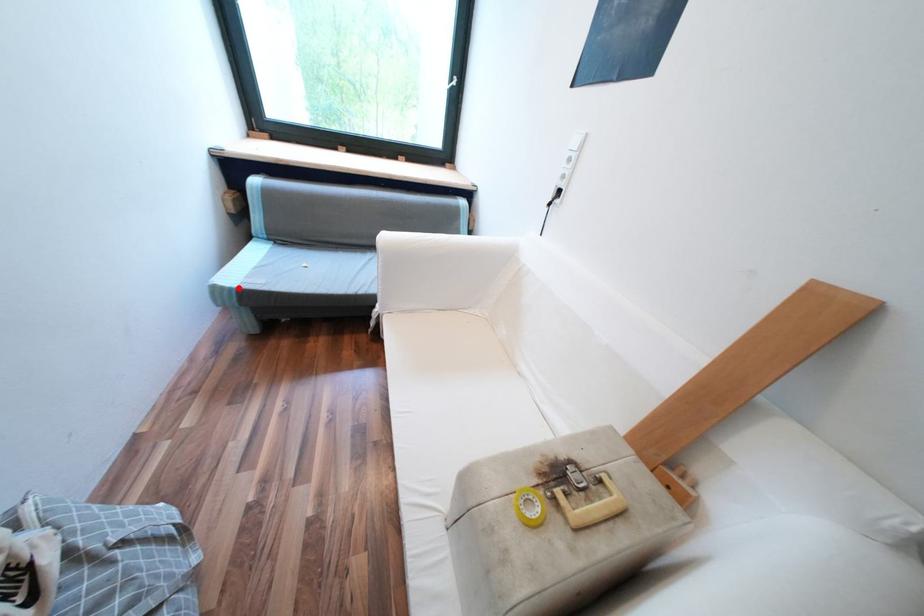
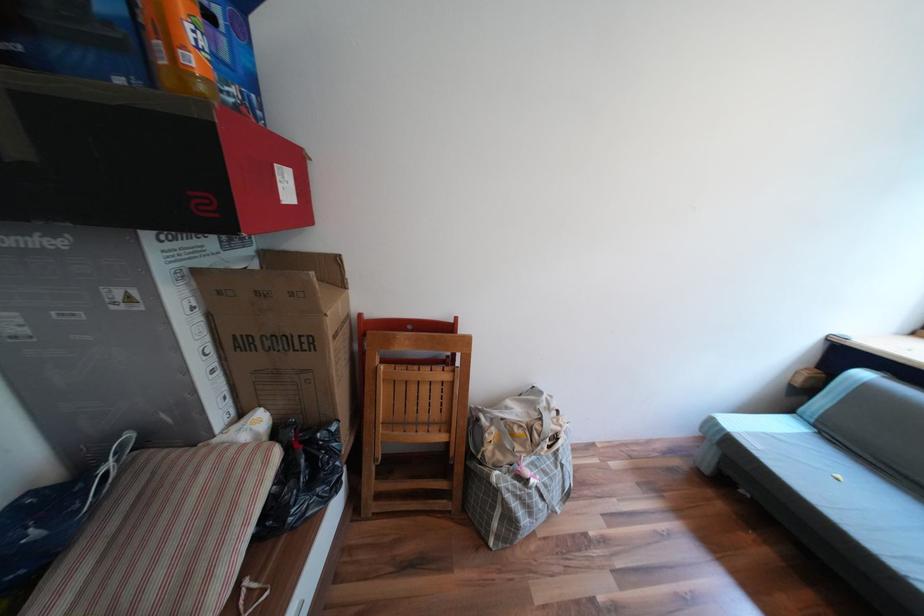
Where in the second image is the point corresponding to the highlighted location from the first image?

(733, 428)